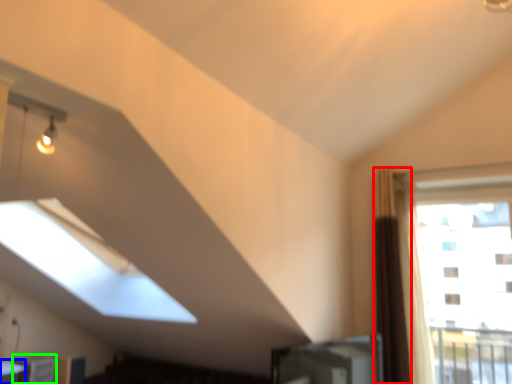
Question: Which object is positioned closest to curtain (highlighted by a red box)? Select from table (highlighted by a blue box) and furniture (highlighted by a green box).

Choices:
 (A) table
 (B) furniture

Answer: (B)